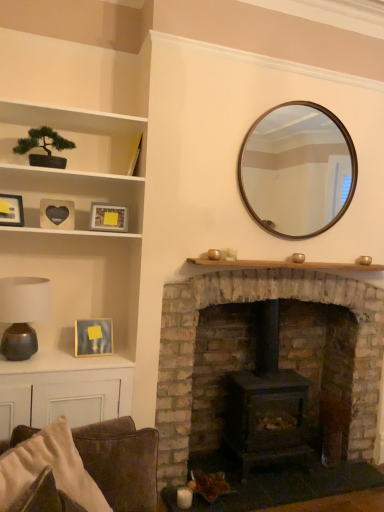
Where is `vacant space to the right of matte brown lamp at left`? The image size is (384, 512). vacant space to the right of matte brown lamp at left is located at coordinates (67, 360).